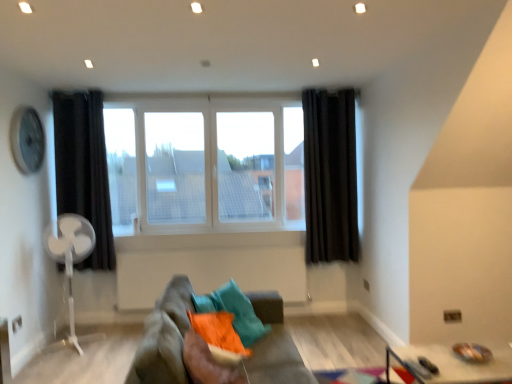
You are a GUI agent. You are given a task and a screenshot of the screen. Output one action in this format:
    pyautogui.click(x=<x>, y=<y>)
    Task: Click on the free region under white glass window at center (from a real-world perspective)
    The height and width of the screenshot is (384, 512).
    Given the screenshot: What is the action you would take?
    pyautogui.click(x=201, y=225)